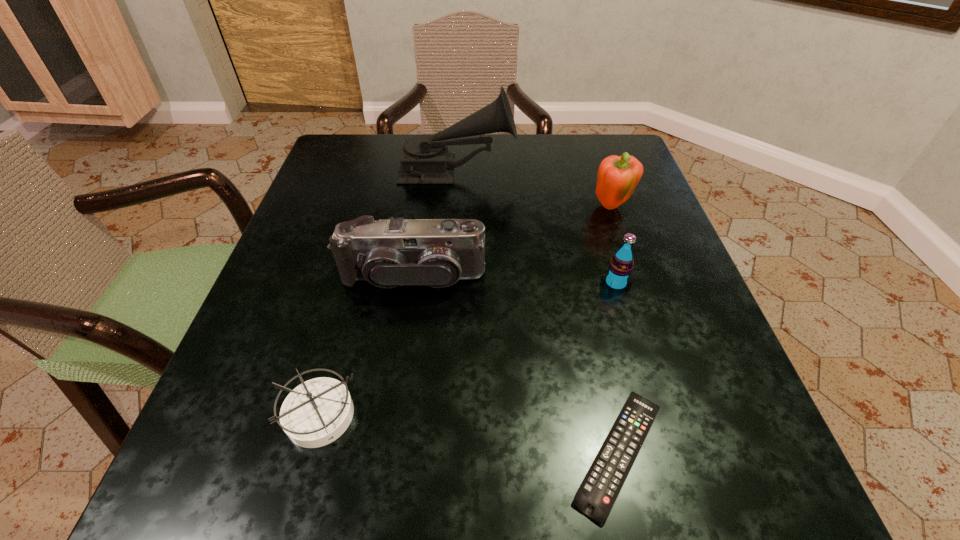
What are the coordinates of `vacant region located on the back of the soda` in the screenshot? It's located at (596, 217).

The width and height of the screenshot is (960, 540). Find the location of `vacant space positioned on the right of the fifth tallest object`. vacant space positioned on the right of the fifth tallest object is located at coordinates (589, 415).

You are a GUI agent. You are given a task and a screenshot of the screen. Output one action in this format:
    pyautogui.click(x=<x>, y=<y>)
    Task: Click on the free space located on the back of the shortest object
    The width and height of the screenshot is (960, 540).
    Given the screenshot: What is the action you would take?
    pyautogui.click(x=567, y=219)

This screenshot has height=540, width=960. Find the location of `object situated at the far edge`. object situated at the far edge is located at coordinates tap(425, 159).

Identify the location of compass at the near edge. Image resolution: width=960 pixels, height=540 pixels. (317, 412).

Locate an element on the screen. remote control at the near edge is located at coordinates (596, 495).

Locate an element on the screen. The height and width of the screenshot is (540, 960). camcorder present at the left edge is located at coordinates (389, 253).

You are a GUI agent. You are given a task and a screenshot of the screen. Output one action in this format:
    pyautogui.click(x=<x>, y=<y>)
    Task: Click on the compass that is at the left edge
    This screenshot has height=540, width=960.
    Given the screenshot: What is the action you would take?
    pyautogui.click(x=317, y=412)

Find the location of a particular element. pepper at the right edge is located at coordinates (618, 176).

In order to click on soda located in the right edge section of the desktop in this screenshot , I will do `click(617, 277)`.